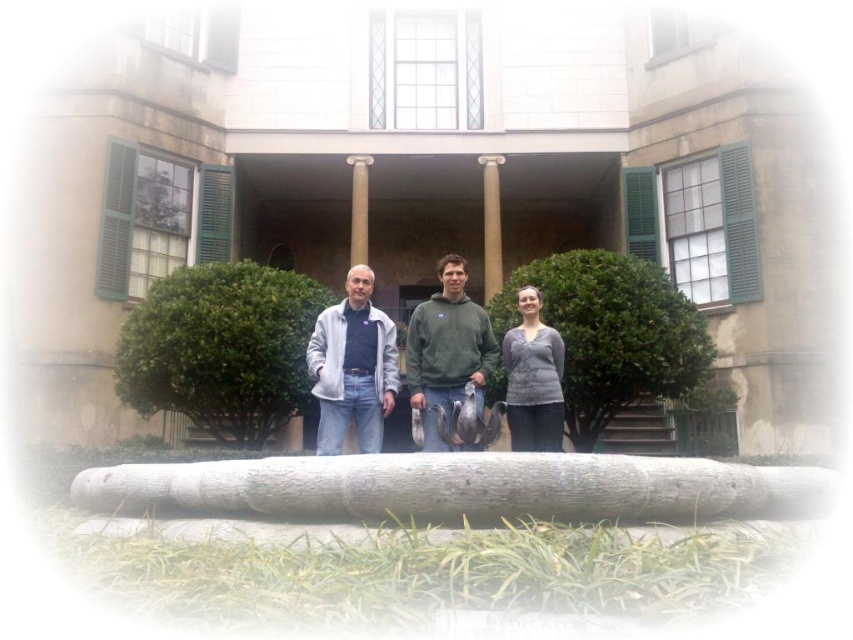
Does light gray fleece jacket at center come in front of green fleece at center?

That is False.

Locate an element on the screen. light gray fleece jacket at center is located at coordinates 352,368.

Does point (384, 404) come in front of point (439, 291)?

Yes, it is in front of point (439, 291).

This screenshot has height=640, width=853. Identify the location of light gray fleece jacket at center. (352, 368).

What do you see at coordinates (532, 378) in the screenshot?
I see `gray matte sweater at center` at bounding box center [532, 378].

Does point (555, 403) come in front of point (367, 204)?

Yes.

This screenshot has height=640, width=853. Find the location of `gray matte sweater at center`. gray matte sweater at center is located at coordinates (532, 378).

Looking at this image, is light gray fleece jacket at center positioned at the back of gray matte sweater at center?

No, it is in front of gray matte sweater at center.

Is light gray fleece jacket at center wider than gray matte sweater at center?

Yes, light gray fleece jacket at center is wider than gray matte sweater at center.

Between point (384, 413) and point (511, 410), which one is positioned in front?

Point (384, 413)

Locate an element on the screen. light gray fleece jacket at center is located at coordinates (352, 368).